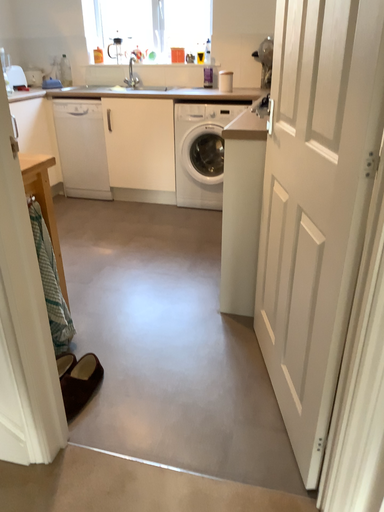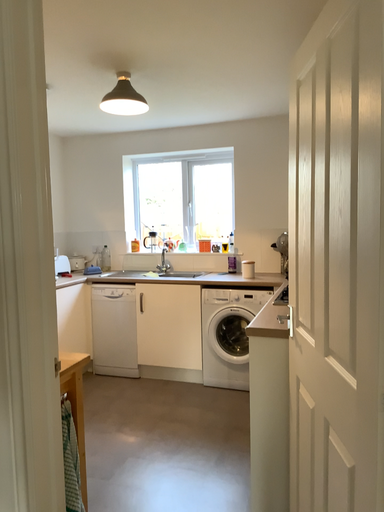
Question: How did the camera likely rotate when shooting the video?

Choices:
 (A) rotated upward
 (B) rotated downward

Answer: (A)